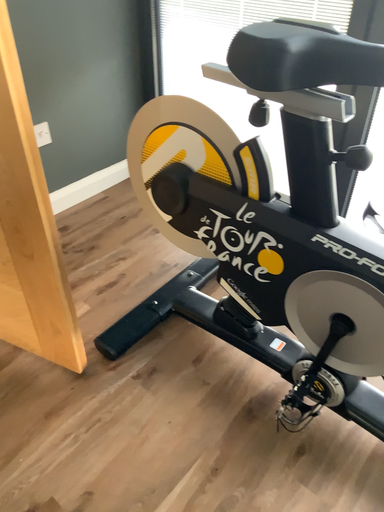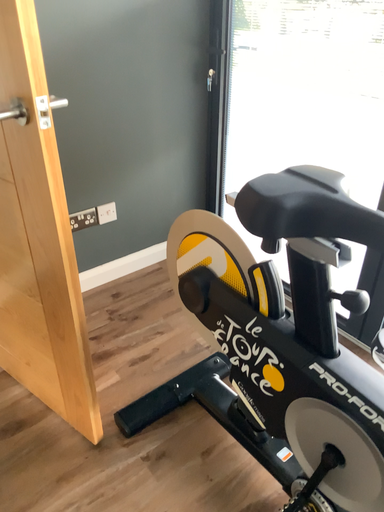
Question: How did the camera likely rotate when shooting the video?

Choices:
 (A) rotated downward
 (B) rotated upward

Answer: (B)